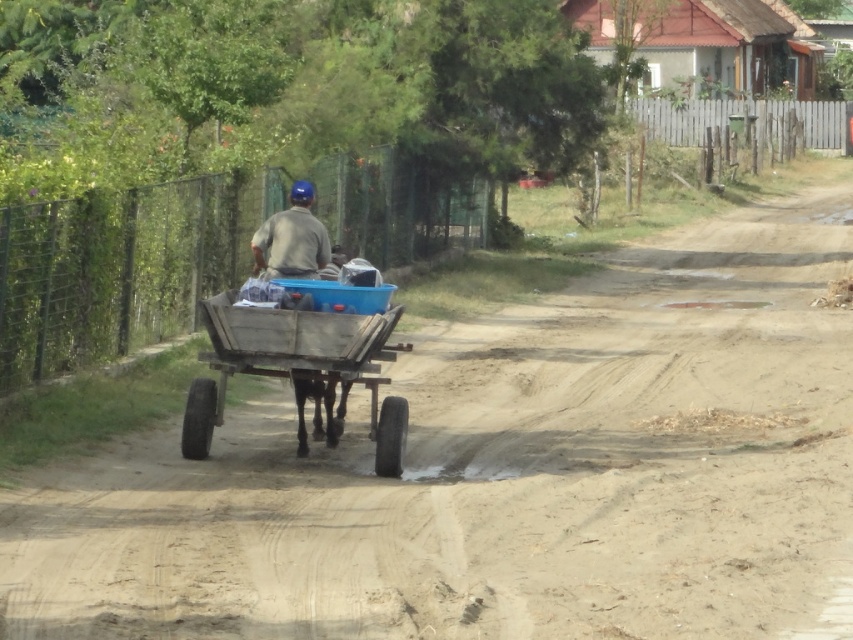
In order to click on wooden wagon at center in this screenshot , I will do `click(296, 365)`.

Between point (329, 376) and point (254, 260), which one is positioned behind?

Positioned behind is point (254, 260).

Where is `wooden wagon at center`? wooden wagon at center is located at coordinates (296, 365).

Who is positioned more to the right, brown sandy dirt track at center or wooden wagon at center?

brown sandy dirt track at center is more to the right.

Is brown sandy dirt track at center to the left of wooden wagon at center from the viewer's perspective?

Incorrect, brown sandy dirt track at center is not on the left side of wooden wagon at center.

Find the location of a particular element. This screenshot has width=853, height=640. brown sandy dirt track at center is located at coordinates (505, 474).

Where is `brown sandy dirt track at center`? This screenshot has height=640, width=853. brown sandy dirt track at center is located at coordinates (505, 474).

Is brown sandy dirt track at center closer to the viewer compared to matte blue helmet at center?

That is True.

At what (x,y) coordinates should I click in order to perform the action: click on brown sandy dirt track at center. Please return your answer as a coordinate pair (x, y). Looking at the image, I should click on (505, 474).